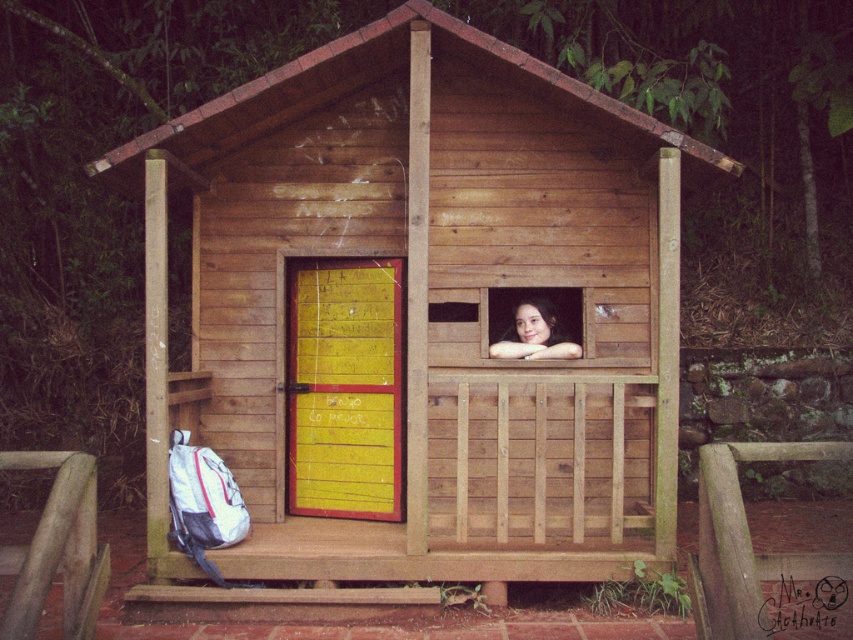
You are a visitor approaching the wooden cabin at center and the smooth skin at window center. Which object is closer to the ground?

The smooth skin at window center is closer to the ground because the wooden cabin at center is positioned over it.

Consider the image. You are a visitor approaching the wooden cabin at center and notice the smooth skin at window center. Which object would you see first as you walk towards the cabin?

The wooden cabin at center would be seen first because it is larger than the smooth skin at window center, making it more prominent in your view.